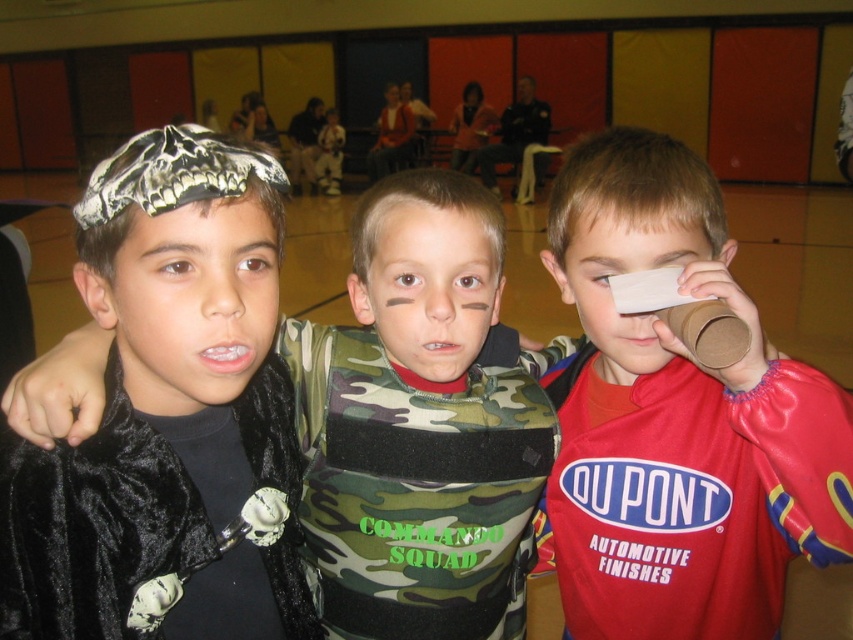
You are organizing a craft activity for children and have two materials available. The camouflage fabric at center and the red matte paper at right. If you need to choose the larger material for a group project, which one should you pick?

The red matte paper at right is larger than the camouflage fabric at center, so you should choose the red matte paper at right for the group project.

You are standing in the gymnasium and notice the matte black headband at center. Based on its position, can you determine if it is closer to the front or the back of the image?

The matte black headband at center is located at point 0.473 on the horizontal axis and 0.226 on the vertical axis. Since the vertical coordinate is closer to 0.226, which is near the bottom of the image, it indicates that the headband is positioned closer to the front of the image.